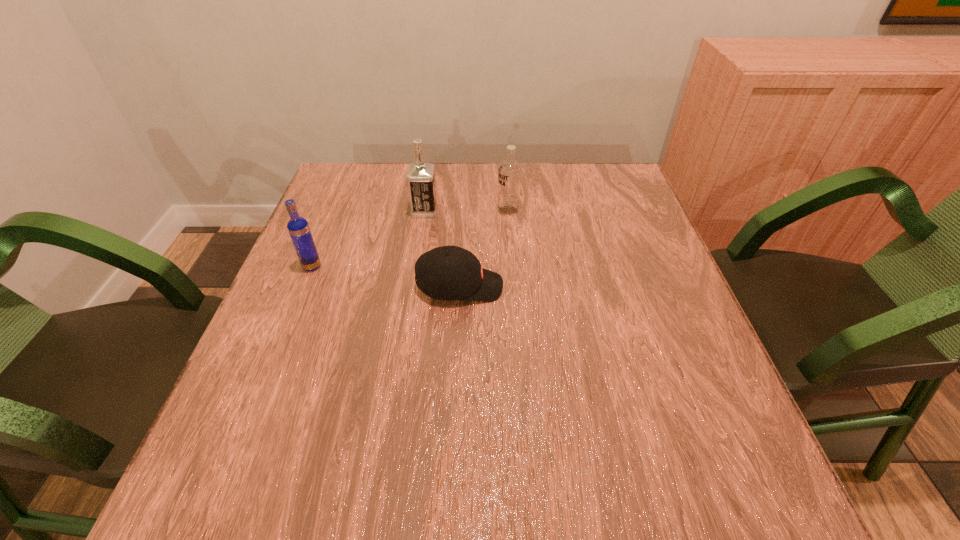
Find the location of a particular element. The width and height of the screenshot is (960, 540). the second vodka from left to right is located at coordinates (421, 182).

Identify the location of the rightmost vodka. (509, 173).

Identify the location of the nearest vodka. (298, 227).

This screenshot has height=540, width=960. I want to click on the leftmost vodka, so click(x=298, y=227).

The height and width of the screenshot is (540, 960). What are the coordinates of `baseball cap` in the screenshot? It's located at (450, 272).

At what (x,y) coordinates should I click in order to perform the action: click on free spot located 0.050m on the front label of the second vodka from left to right. Please return your answer as a coordinate pair (x, y). The width and height of the screenshot is (960, 540). Looking at the image, I should click on (456, 211).

Identify the location of free spot located on the front label of the rightmost vodka. The height and width of the screenshot is (540, 960). (378, 211).

Image resolution: width=960 pixels, height=540 pixels. Identify the location of free region located 0.330m on the front label of the rightmost vodka. [371, 211].

You are a GUI agent. You are given a task and a screenshot of the screen. Output one action in this format:
    pyautogui.click(x=<x>, y=<y>)
    Task: Click on the free region located on the front label of the rightmost vodka
    The image size is (960, 540).
    Given the screenshot: What is the action you would take?
    pyautogui.click(x=455, y=211)

This screenshot has height=540, width=960. In order to click on blank area located 0.080m on the back of the nearest vodka in this screenshot , I will do `click(324, 238)`.